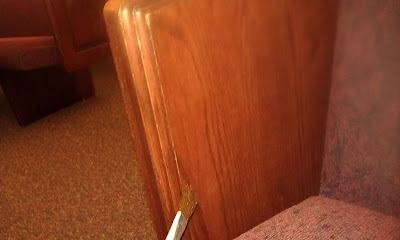
This screenshot has width=400, height=240. I want to click on wooden seat leg, so click(x=60, y=89).